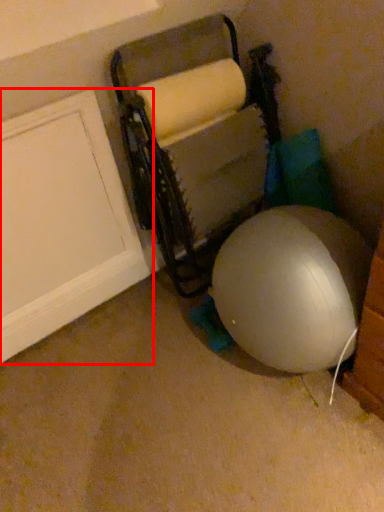
Question: From the image's perspective, considering the relative positions of door (annotated by the red box) and bean bag chair in the image provided, where is door (annotated by the red box) located with respect to the staircase?

Choices:
 (A) above
 (B) below

Answer: (B)